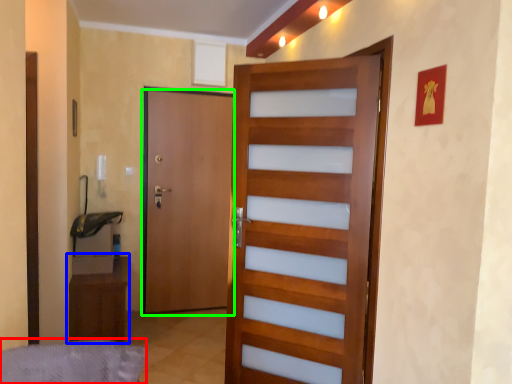
Question: Based on their relative distances, which object is farther from bed frame (highlighted by a red box)? Choose from furniture (highlighted by a blue box) and door (highlighted by a green box).

Choices:
 (A) furniture
 (B) door

Answer: (B)